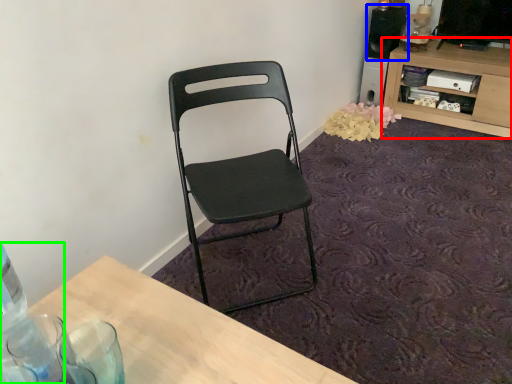
Question: Estimate the real-world distances between objects in this image. Which object is farther from shelf (highlighted by a red box), loudspeaker (highlighted by a blue box) or bottle (highlighted by a green box)?

Choices:
 (A) loudspeaker
 (B) bottle

Answer: (B)